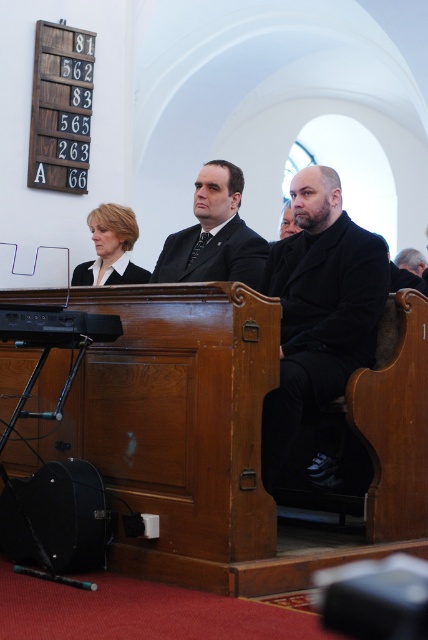
You are attending a formal event and see both the black matte coat at center and the black matte suit at center. Which one is bigger in size?

The black matte coat at center is larger in size compared to the black matte suit at center.